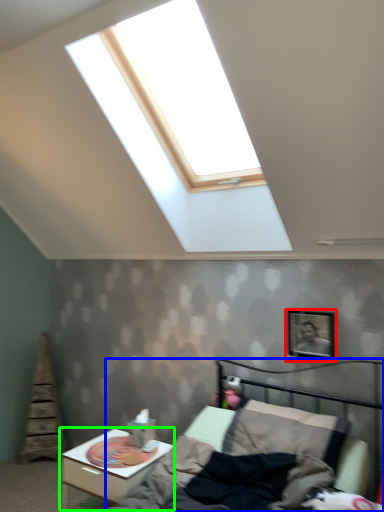
Question: Which object is the closest to the picture frame (highlighted by a red box)? Choose among these: bed (highlighted by a blue box) or nightstand (highlighted by a green box).

Choices:
 (A) bed
 (B) nightstand

Answer: (A)